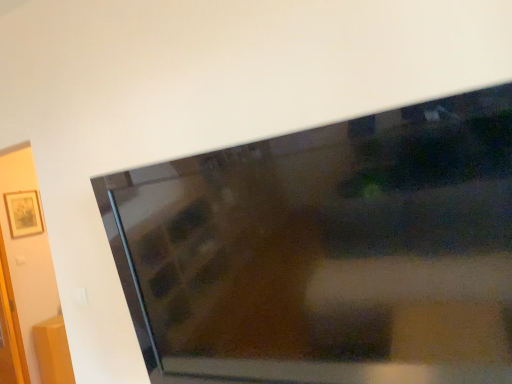
Locate an element on the screen. This screenshot has width=512, height=384. matte black tv at upper center is located at coordinates (329, 250).

Measure the distance between matte black tv at upper center and camera.

matte black tv at upper center is 29.36 inches away from camera.

What do you see at coordinates (329, 250) in the screenshot? This screenshot has width=512, height=384. I see `matte black tv at upper center` at bounding box center [329, 250].

Locate an element on the screen. matte black tv at upper center is located at coordinates (329, 250).